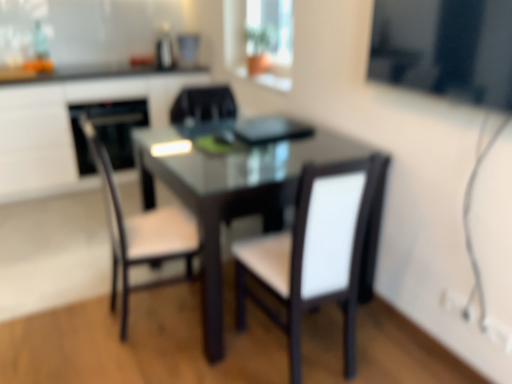
Where is `vacant point to the right of white leather chair at center, the third chair positioned from the left`? The width and height of the screenshot is (512, 384). vacant point to the right of white leather chair at center, the third chair positioned from the left is located at coordinates (389, 347).